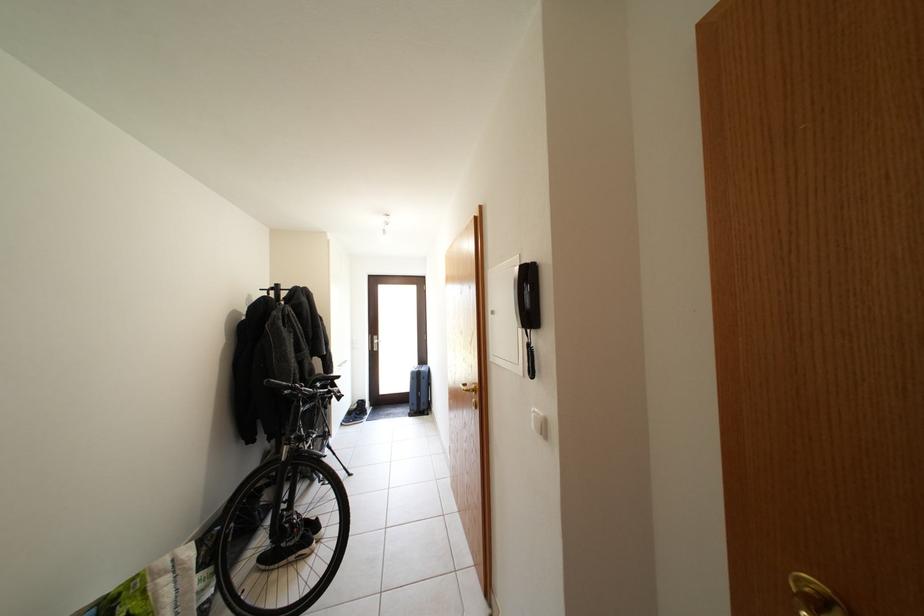
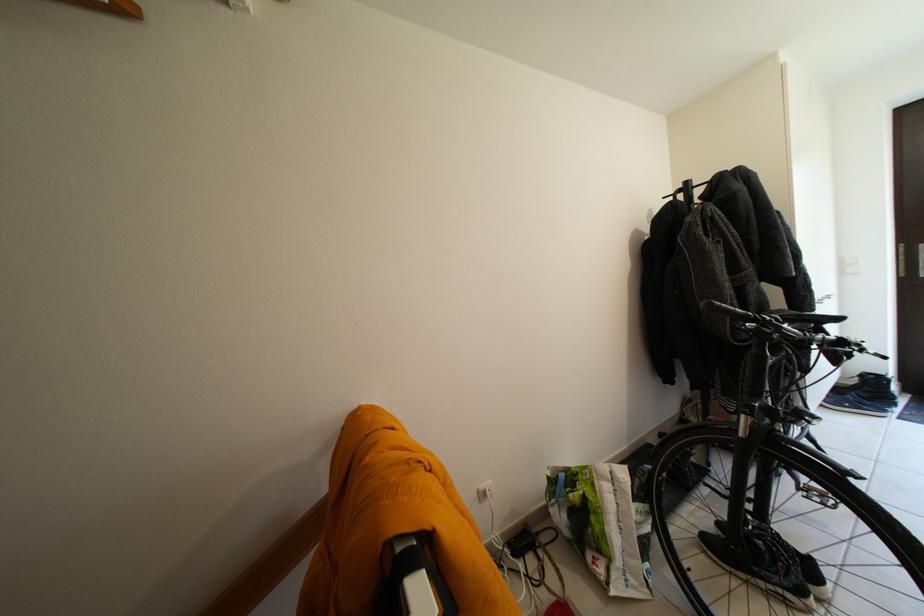
In the second image, find the point that corresponds to pixel 306 544 in the first image.

(794, 588)